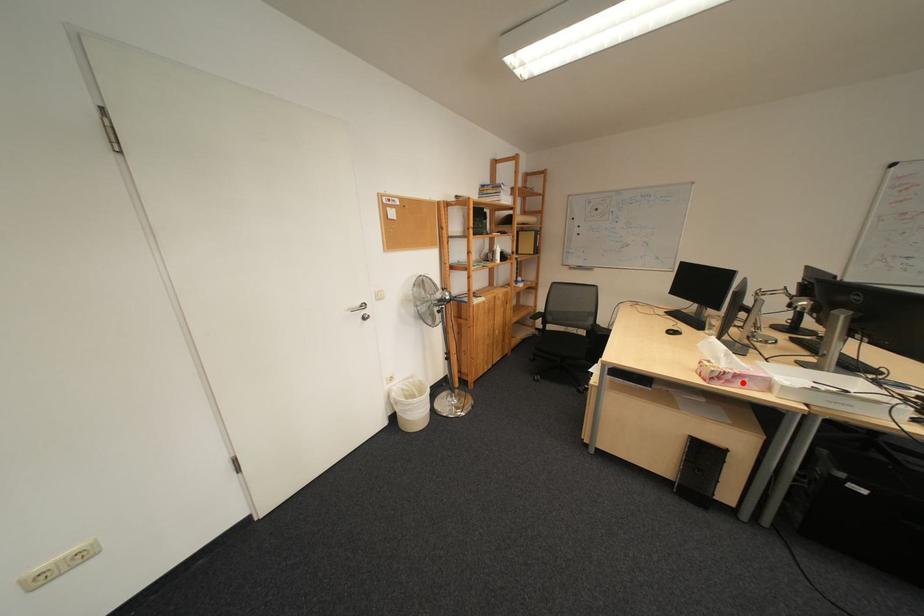
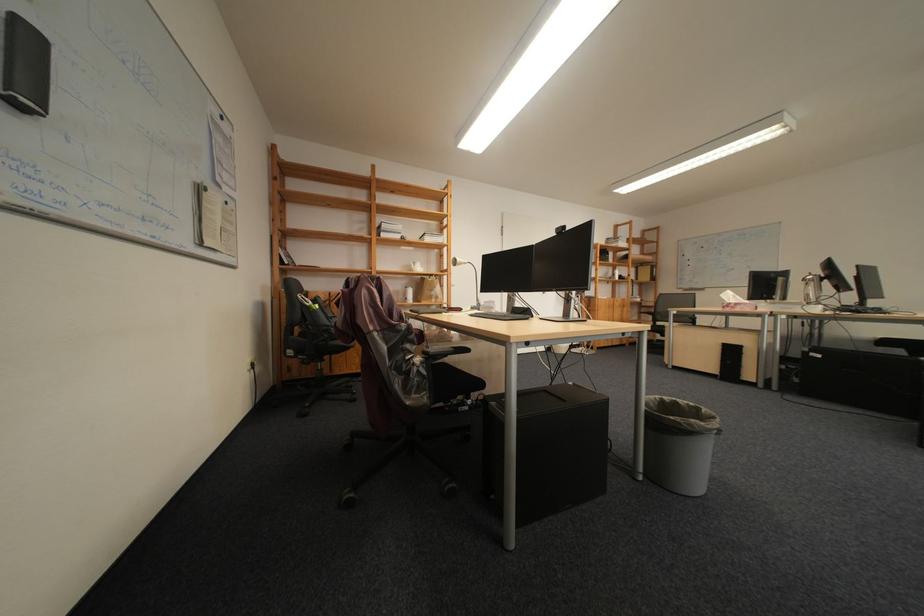
The point at the highlighted location is marked in the first image. Where is the corresponding point in the second image?

(747, 309)